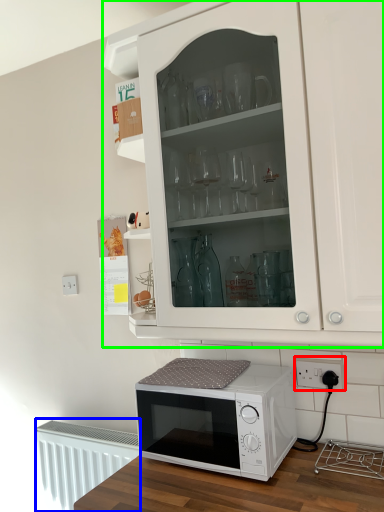
Question: Based on their relative distances, which object is farther from electric outlet (highlighted by a red box)? Choose from radiator (highlighted by a blue box) and cabinetry (highlighted by a green box).

Choices:
 (A) radiator
 (B) cabinetry

Answer: (A)